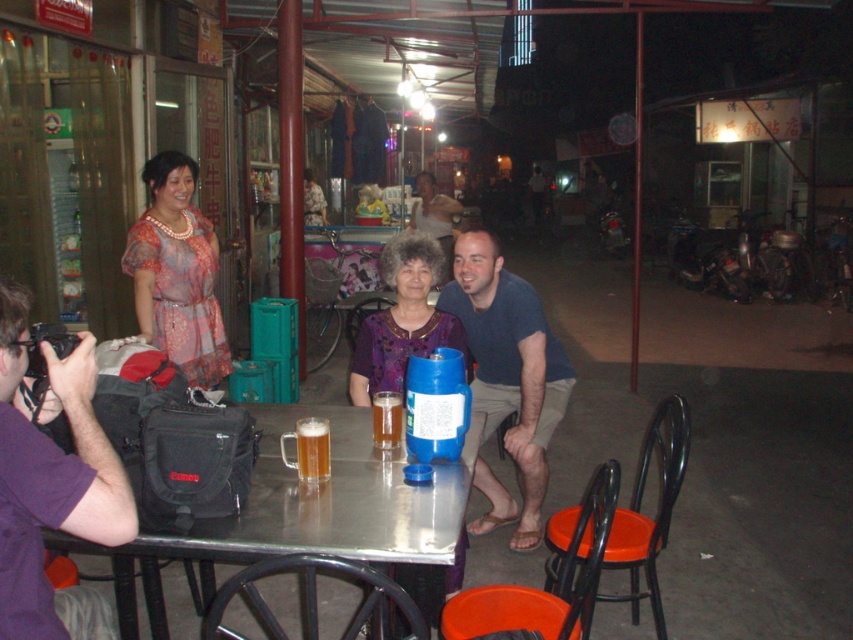
Question: Which of the following is the farthest from the observer?

Choices:
 (A) (245, 540)
 (B) (152, 209)

Answer: (B)

Question: Does metallic silver table at center have a greater width compared to translucent glass mug at table center?

Choices:
 (A) no
 (B) yes

Answer: (B)

Question: Which point appears closest to the camera in this image?

Choices:
 (A) (462, 339)
 (B) (373, 435)

Answer: (B)

Question: Does metallic silver table at center have a greater width compared to printed silk dress at left?

Choices:
 (A) yes
 (B) no

Answer: (A)

Question: Does blue fabric shirt at center appear on the left side of translucent glass mug at table center?

Choices:
 (A) no
 (B) yes

Answer: (A)

Question: Which of the following is the farthest from the observer?

Choices:
 (A) purple fabric shirt at center
 (B) translucent glass mug at table center
 (C) blue fabric shirt at center

Answer: (C)